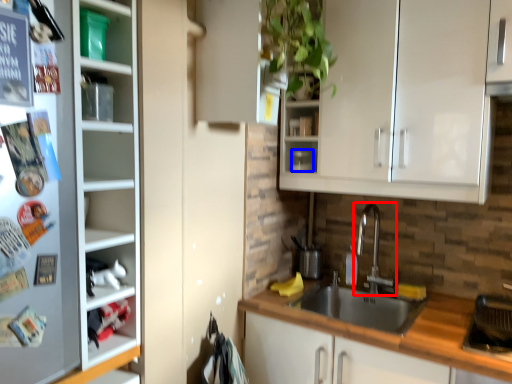
Question: Which object appears closest to the camera in this image, tap (highlighted by a red box) or appliance (highlighted by a blue box)?

Choices:
 (A) tap
 (B) appliance

Answer: (A)